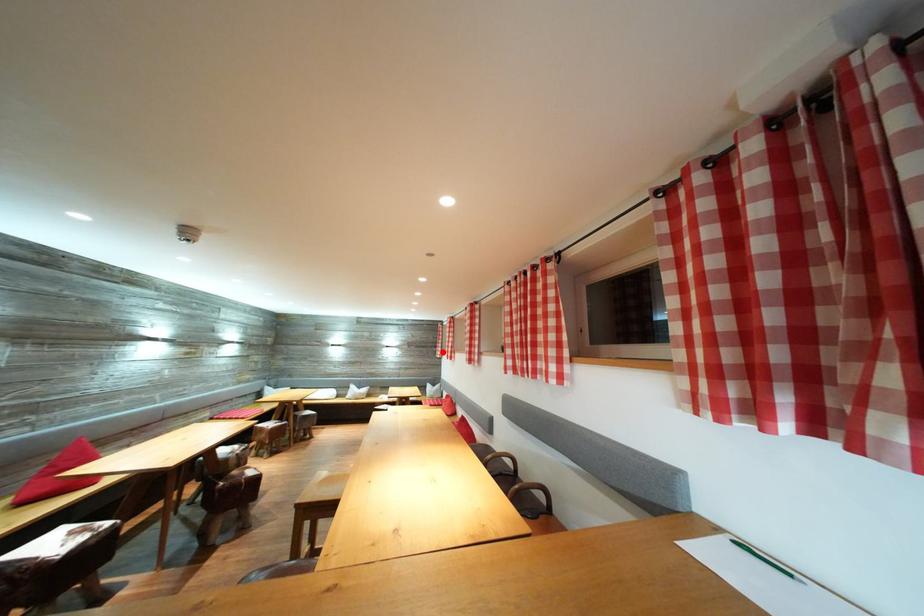
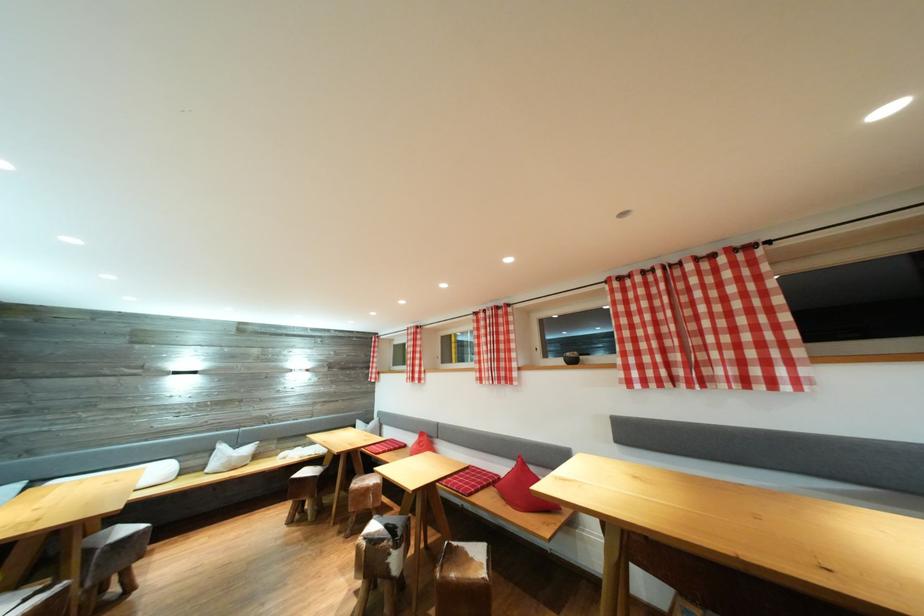
Question: I am providing you with two images of the same scene from different viewpoints. A red point is marked on the first image. Is the red point's position out of view in image 2?

Choices:
 (A) Yes
 (B) No

Answer: (B)